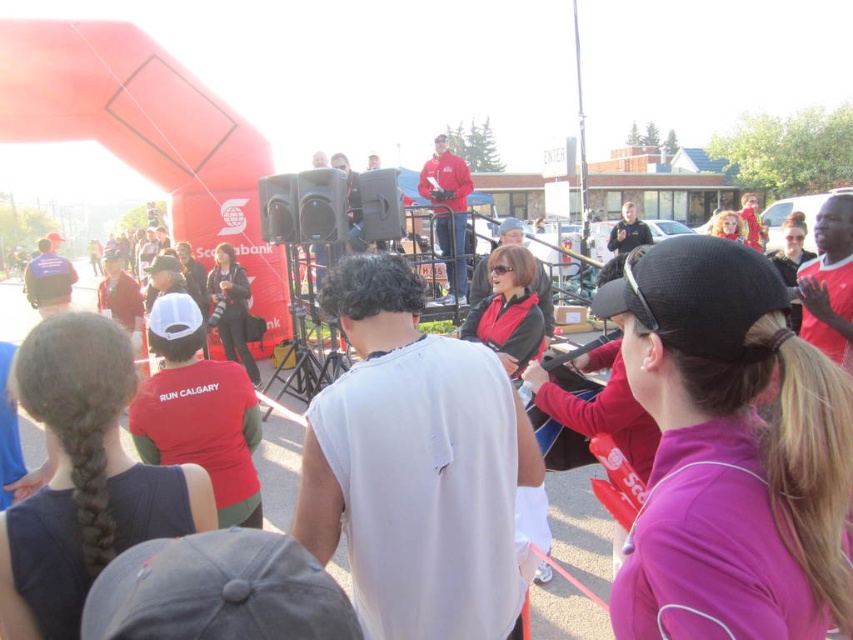
Measure the distance from white matte shirt at center to matte red jacket at upper center.

white matte shirt at center is 8.57 meters from matte red jacket at upper center.

The height and width of the screenshot is (640, 853). In order to click on white matte shirt at center in this screenshot , I will do `click(415, 467)`.

Identify the location of white matte shirt at center. The width and height of the screenshot is (853, 640). (415, 467).